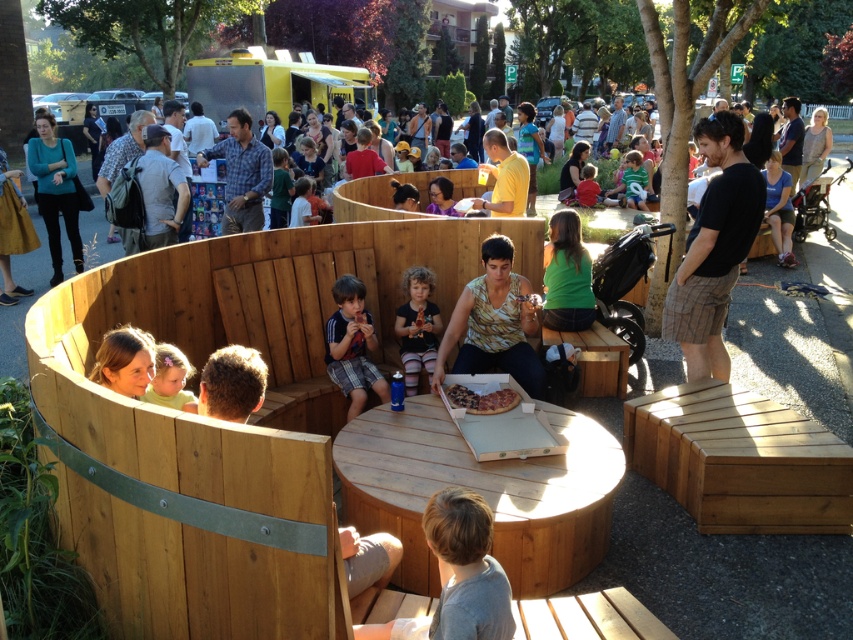
Identify the location of wooden table at center. Image resolution: width=853 pixels, height=640 pixels. (482, 492).

Is wooden table at center positioned in front of matte black shirt at center?

Yes, it is in front of matte black shirt at center.

Where is `wooden table at center`? The image size is (853, 640). wooden table at center is located at coordinates (482, 492).

Does striped t-shirt at center have a larger size compared to light brown hair at lower left?

Indeed, striped t-shirt at center has a larger size compared to light brown hair at lower left.

Which is above, striped t-shirt at center or light brown hair at lower left?

striped t-shirt at center is higher up.

Who is more distant from viewer, [335,321] or [154,403]?

The point [335,321] is behind.

You are a GUI agent. You are given a task and a screenshot of the screen. Output one action in this format:
    pyautogui.click(x=<x>, y=<y>)
    Task: Click on the striped t-shirt at center
    The height and width of the screenshot is (640, 853).
    Given the screenshot: What is the action you would take?
    pyautogui.click(x=352, y=346)

Is striped t-shirt at center thinner than matte black shirt at center?

In fact, striped t-shirt at center might be wider than matte black shirt at center.

How distant is striped t-shirt at center from matte black shirt at center?

The distance of striped t-shirt at center from matte black shirt at center is 36.64 centimeters.

Is point (345, 380) closer to viewer compared to point (424, 352)?

Yes, it is in front of point (424, 352).

Identify the location of striped t-shirt at center. (352, 346).